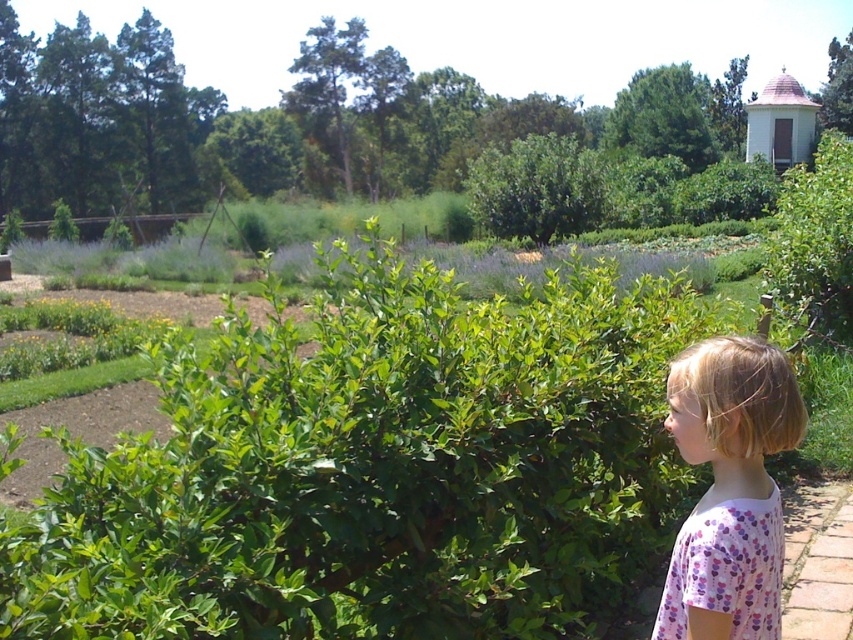
Question: Is pink floral shirt at lower right in front of green leafy bush at center?

Choices:
 (A) no
 (B) yes

Answer: (B)

Question: Among these objects, which one is nearest to the camera?

Choices:
 (A) pink floral shirt at lower right
 (B) brick pavement at lower right

Answer: (A)

Question: Which is nearer to the brick pavement at lower right?

Choices:
 (A) green leafy bush at upper right
 (B) green leafy bush at center

Answer: (A)

Question: Which object is positioned closest to the brick pavement at lower right?

Choices:
 (A) green leafy bush at upper right
 (B) pink floral shirt at lower right

Answer: (B)

Question: Can you confirm if pink floral shirt at lower right is positioned to the left of brick pavement at lower right?

Choices:
 (A) no
 (B) yes

Answer: (B)

Question: Is green leafy bush at upper right bigger than green leafy bush at upper center?

Choices:
 (A) yes
 (B) no

Answer: (A)